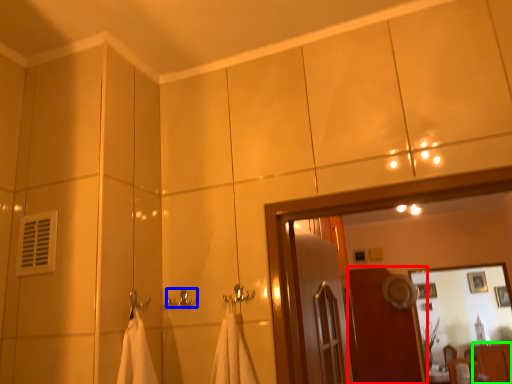
Question: Estimate the real-world distances between objects in this image. Which object is farther from screen door (highlighted by a red box), towel bar (highlighted by a blue box) or dresser (highlighted by a green box)?

Choices:
 (A) towel bar
 (B) dresser

Answer: (A)